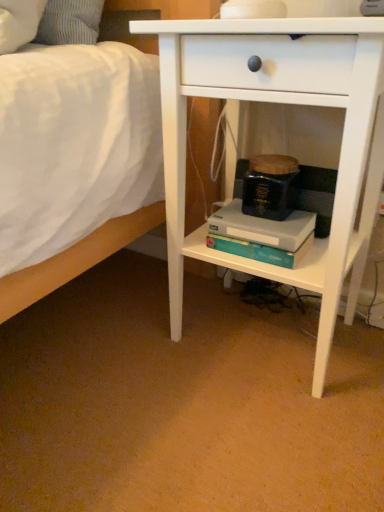
Question: From a real-world perspective, is white matte nightstand at center above or below teal matte paperback book at center, which is counted as the first paperback book, starting from the bottom?

Choices:
 (A) below
 (B) above

Answer: (B)

Question: Which is correct: white matte nightstand at center is inside teal matte paperback book at center, which is counted as the first paperback book, starting from the bottom, or outside of it?

Choices:
 (A) outside
 (B) inside

Answer: (A)

Question: Considering the real-world distances, which object is closest to the teal matte paperback book at center, which is the 1th paperback book in top-to-bottom order?

Choices:
 (A) white matte nightstand at center
 (B) teal matte paperback book at center, the second paperback book viewed from the top

Answer: (B)

Question: Which object is the closest to the teal matte paperback book at center, the second paperback book viewed from the top?

Choices:
 (A) teal matte paperback book at center, which is counted as the 2th paperback book, starting from the bottom
 (B) white matte nightstand at center

Answer: (A)